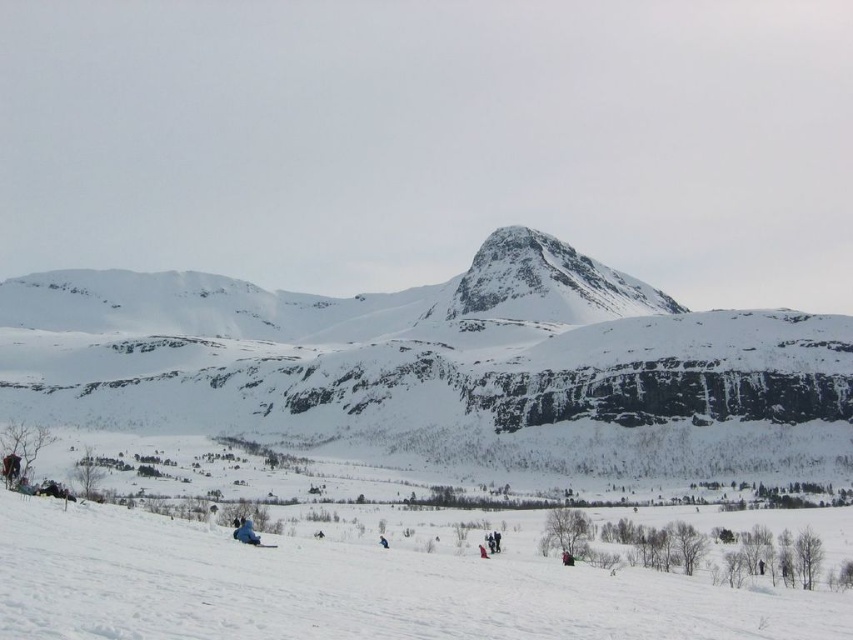
Is point (695, 627) positioned after point (265, 547)?

No, (695, 627) is closer to viewer.

Does white snow ski slope at lower left come in front of blue matte ski at lower left?

That is True.

You are a GUI agent. You are given a task and a screenshot of the screen. Output one action in this format:
    pyautogui.click(x=<x>, y=<y>)
    Task: Click on the white snow ski slope at lower left
    This screenshot has height=640, width=853.
    Given the screenshot: What is the action you would take?
    pyautogui.click(x=352, y=588)

Is white snow-covered mountain at center positioned at the back of blue matte ski at lower left?

Yes, it is behind blue matte ski at lower left.

Who is taller, white snow-covered mountain at center or blue matte ski at lower left?

With more height is white snow-covered mountain at center.

Identify the location of white snow-covered mountain at center. The width and height of the screenshot is (853, 640). (439, 365).

This screenshot has width=853, height=640. In order to click on white snow-covered mountain at center in this screenshot , I will do `click(439, 365)`.

Can you confirm if white snow-covered mountain at center is positioned to the left of white snow ski slope at lower left?

Indeed, white snow-covered mountain at center is positioned on the left side of white snow ski slope at lower left.

Does white snow-covered mountain at center have a greater height compared to white snow ski slope at lower left?

Yes.

Between point (321, 304) and point (227, 604), which one is positioned behind?

Positioned behind is point (321, 304).

The image size is (853, 640). What are the coordinates of `white snow-covered mountain at center` in the screenshot? It's located at (439, 365).